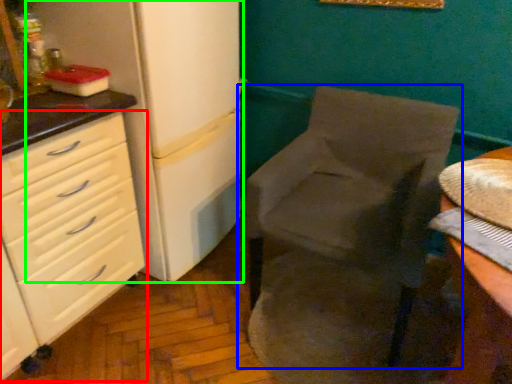
Question: Which object is the closest to the chest of drawers (highlighted by a red box)? Choose among these: chair (highlighted by a blue box) or refrigerator (highlighted by a green box).

Choices:
 (A) chair
 (B) refrigerator

Answer: (B)